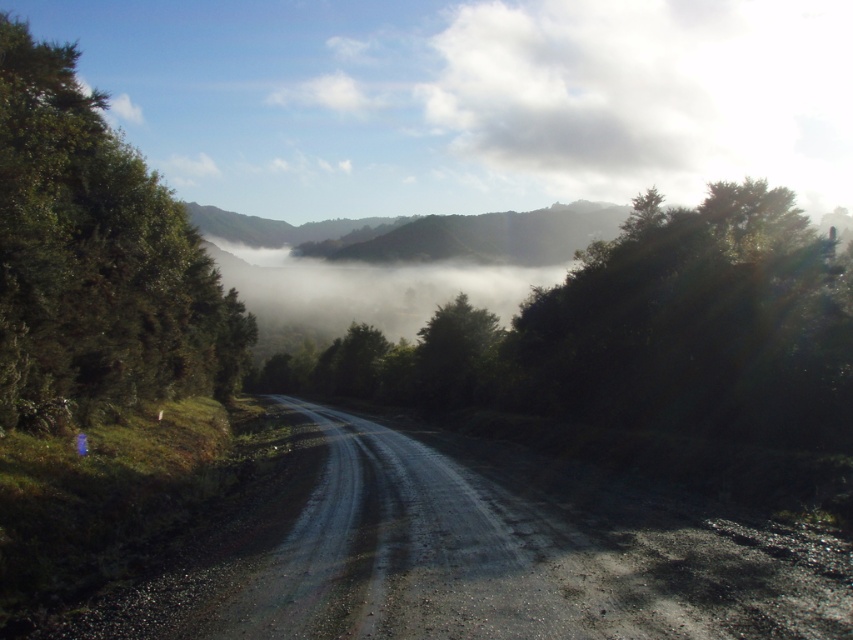
Between dull gray gravel road at center and green leafy tree at left, which one appears on the left side from the viewer's perspective?

green leafy tree at left

How distant is dull gray gravel road at center from green leafy tree at left?

The distance of dull gray gravel road at center from green leafy tree at left is 18.06 meters.

Is point (700, 582) behind point (20, 211)?

That is False.

This screenshot has width=853, height=640. In order to click on dull gray gravel road at center in this screenshot , I will do `click(462, 552)`.

Is green leafy tree at right smaller than green leafy tree at left?

Indeed, green leafy tree at right has a smaller size compared to green leafy tree at left.

Is point (685, 412) closer to viewer compared to point (134, 221)?

Yes, it is in front of point (134, 221).

Locate an element on the screen. green leafy tree at right is located at coordinates (x=697, y=324).

Does white fluffy cloud at upper center lie behind green matte tree at center?

Yes, it is.

Who is more distant from viewer, (450,109) or (456,349)?

The point (450,109) is behind.

Where is `white fluffy cloud at upper center`? The image size is (853, 640). white fluffy cloud at upper center is located at coordinates coord(548,104).